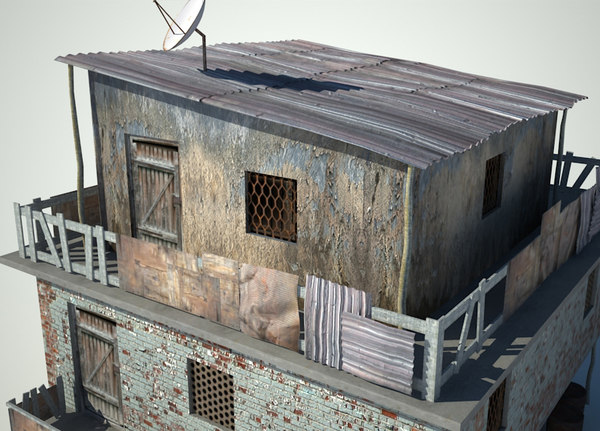
Identify the location of window. (285, 214).